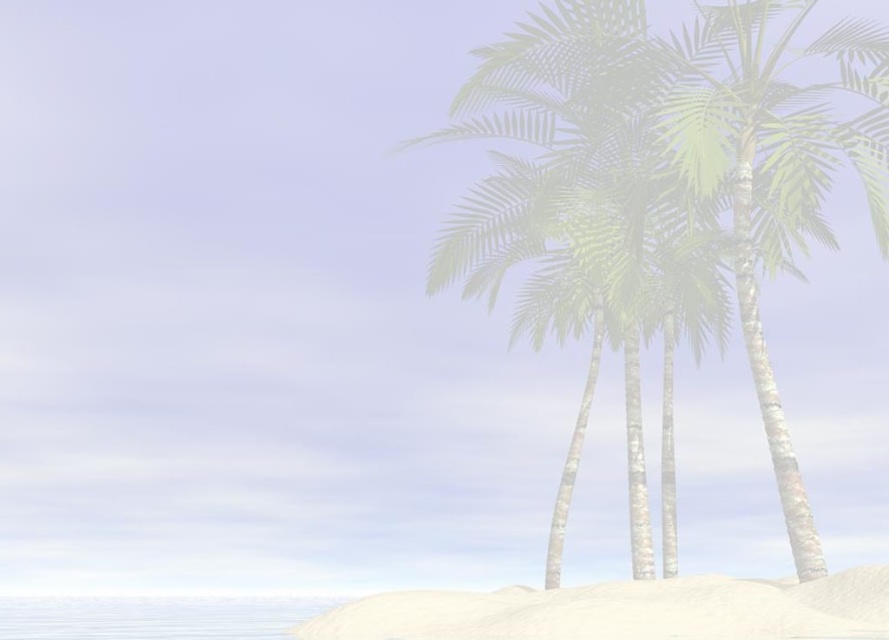
You are a beach photographer planning to capture the green leafy palm tree at right and the white sandy beach at lower center in a single frame. Which object should you focus on first if you want to ensure both are in sharp focus?

The green leafy palm tree at right is thinner than the white sandy beach at lower center, so you should focus on the palm tree first to ensure both are in sharp focus.

You are standing on the white sandy beach at lower center and looking towards the green leafy palm tree at right. Which object is taller from your perspective?

The white sandy beach at lower center is taller than the green leafy palm tree at right from your perspective.

You are a photographer planning to capture the green leafy palm tree at right and the white sandy beach at lower center in a single frame. Which object should you focus on first if you want to ensure both are in sharp focus?

The green leafy palm tree at right has a smaller size compared to the white sandy beach at lower center, so you should focus on the smaller object first to ensure both are in sharp focus.